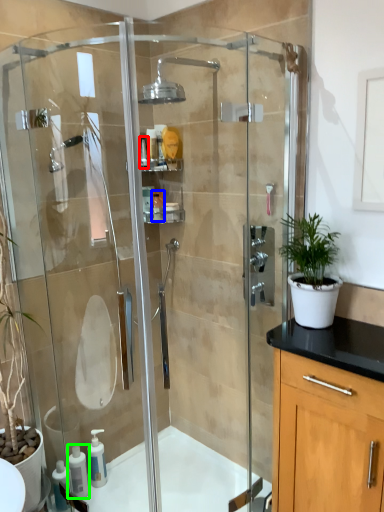
Question: Considering the real-world distances, which object is farthest from toiletry (highlighted by a red box)? toiletry (highlighted by a blue box) or soap dispenser (highlighted by a green box)?

Choices:
 (A) toiletry
 (B) soap dispenser

Answer: (B)